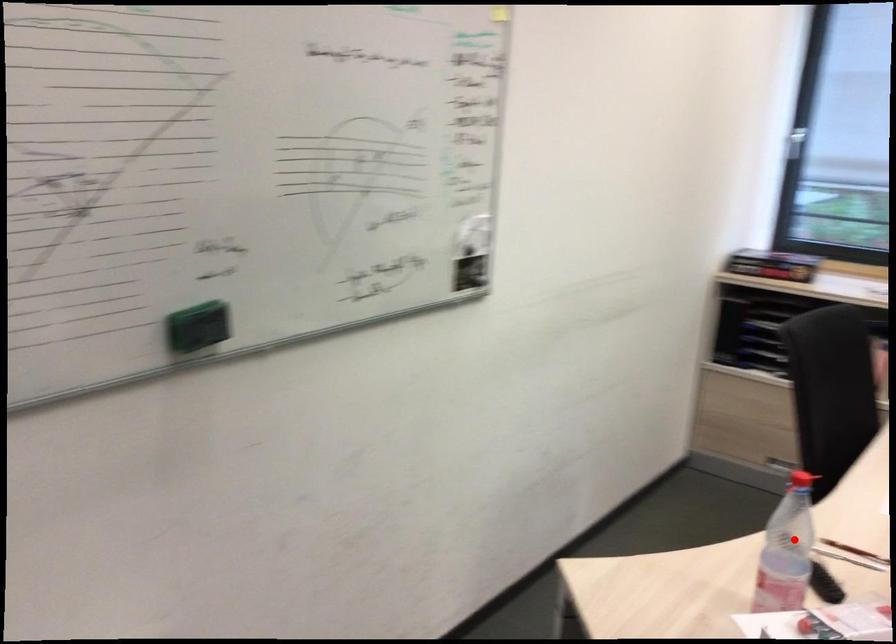
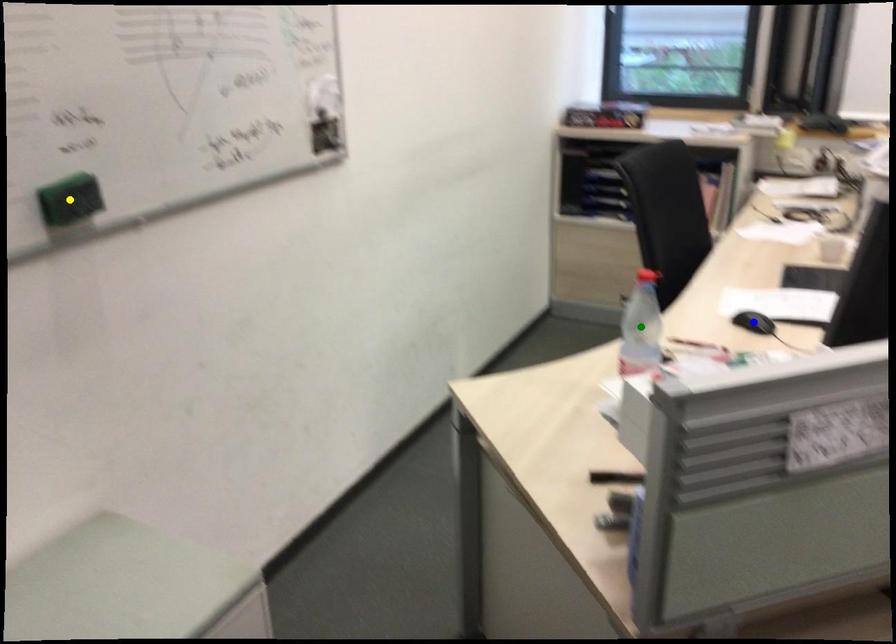
Question: I am providing you with two images of the same scene from different viewpoints. A red point is marked on the first image. You are given multiple points on the second image. Which mark in image 2 goes with the point in image 1?

Choices:
 (A) blue point
 (B) green point
 (C) yellow point

Answer: (B)